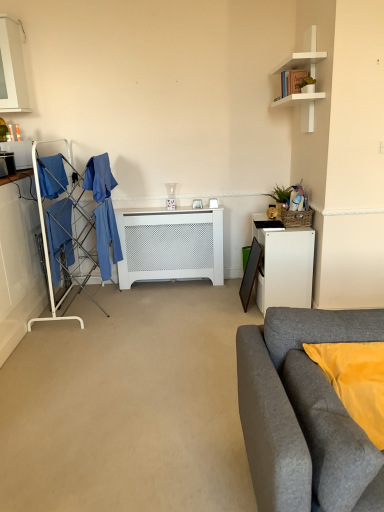
Question: From the image's perspective, would you say green matte plant at upper right, the 2th houseplant positioned from the back, is shown under white matte shelf at upper right?

Choices:
 (A) yes
 (B) no

Answer: (A)

Question: Considering the relative positions of green matte plant at upper right, the 1th houseplant when ordered from top to bottom, and white matte shelf at upper right in the image provided, is green matte plant at upper right, the 1th houseplant when ordered from top to bottom, to the left of white matte shelf at upper right from the viewer's perspective?

Choices:
 (A) yes
 (B) no

Answer: (B)

Question: From the image's perspective, is green matte plant at upper right, which is the 2th houseplant from bottom to top, on top of white matte shelf at upper right?

Choices:
 (A) no
 (B) yes

Answer: (A)

Question: Can you confirm if green matte plant at upper right, the 1th houseplant when ordered from top to bottom, is taller than white matte shelf at upper right?

Choices:
 (A) no
 (B) yes

Answer: (A)

Question: Is green matte plant at upper right, which is the 2th houseplant from bottom to top, located outside white matte shelf at upper right?

Choices:
 (A) no
 (B) yes

Answer: (A)

Question: From a real-world perspective, is green matte plant at upper right, which is the 2th houseplant from bottom to top, positioned under white matte shelf at upper right based on gravity?

Choices:
 (A) yes
 (B) no

Answer: (A)

Question: Considering the relative positions of green matte plant at upper right, which is the first houseplant from front to back, and white matte radiator at center in the image provided, is green matte plant at upper right, which is the first houseplant from front to back, behind white matte radiator at center?

Choices:
 (A) yes
 (B) no

Answer: (B)

Question: Can you confirm if green matte plant at upper right, the 1th houseplant when ordered from top to bottom, is shorter than white matte radiator at center?

Choices:
 (A) yes
 (B) no

Answer: (A)

Question: Is green matte plant at upper right, which is the first houseplant from front to back, in contact with white matte radiator at center?

Choices:
 (A) yes
 (B) no

Answer: (B)

Question: Does green matte plant at upper right, which is the first houseplant from front to back, have a greater width compared to white matte radiator at center?

Choices:
 (A) no
 (B) yes

Answer: (A)

Question: Can you confirm if green matte plant at upper right, which is the 2th houseplant from bottom to top, is taller than white matte radiator at center?

Choices:
 (A) no
 (B) yes

Answer: (A)

Question: Are green matte plant at upper right, which is the 2th houseplant from bottom to top, and white matte radiator at center far apart?

Choices:
 (A) no
 (B) yes

Answer: (B)

Question: Can you confirm if green matte plant at upper right, the 2th houseplant positioned from the back, is bigger than green woven basket at upper right, which ranks as the second houseplant in front-to-back order?

Choices:
 (A) no
 (B) yes

Answer: (A)